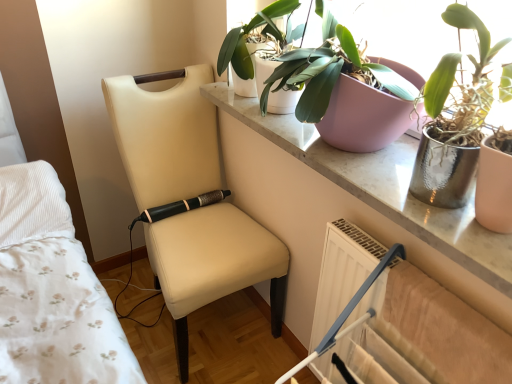
Question: From a real-world perspective, relative to metallic silver pot at upper right, which is the first houseplant from right to left, is green matte plant at upper center, which is the 3th houseplant in right-to-left order, vertically above or below?

Choices:
 (A) below
 (B) above

Answer: (A)

Question: Is point click(282, 13) closer or farther from the camera than point click(470, 23)?

Choices:
 (A) closer
 (B) farther

Answer: (B)

Question: Which is nearer to the green matte plant at upper center, the first houseplant when ordered from left to right?

Choices:
 (A) metallic silver pot at upper right, placed as the second houseplant when sorted from left to right
 (B) beige leather chair at center
 (C) metallic silver pot at upper right, which is the first houseplant from right to left
 (D) matte white table at upper right

Answer: (D)

Question: Which is farther from the metallic silver pot at upper right, marked as the 2th houseplant in a right-to-left arrangement?

Choices:
 (A) metallic silver pot at upper right, acting as the 3th houseplant starting from the left
 (B) matte white table at upper right
 (C) green matte plant at upper center, which is the 3th houseplant in right-to-left order
 (D) beige leather chair at center

Answer: (D)